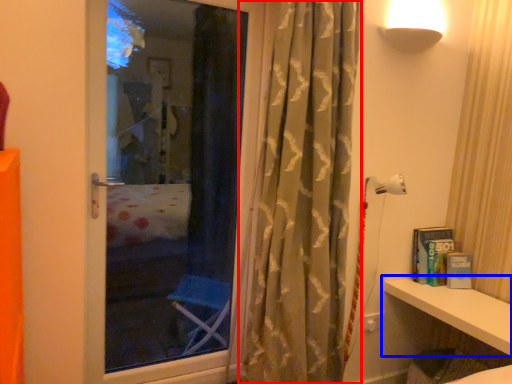
Question: Among these objects, which one is farthest to the camera, curtain (highlighted by a red box) or shelf (highlighted by a blue box)?

Choices:
 (A) curtain
 (B) shelf

Answer: (B)